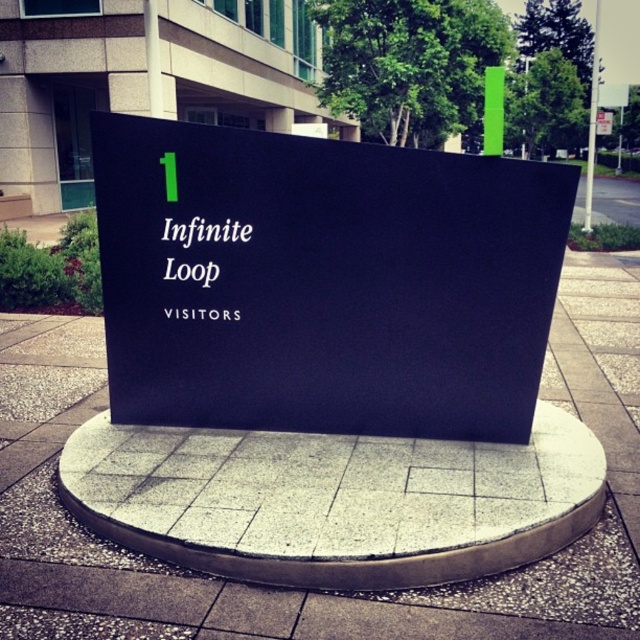
What do you see at coordinates (323, 282) in the screenshot? I see `black matte sign at center` at bounding box center [323, 282].

Between black matte sign at center and white matte sign at center, which one has more height?

black matte sign at center

Measure the distance between point (420, 291) and camera.

Point (420, 291) and camera are 3.63 meters apart.

Image resolution: width=640 pixels, height=640 pixels. Find the location of `black matte sign at center`. black matte sign at center is located at coordinates (323, 282).